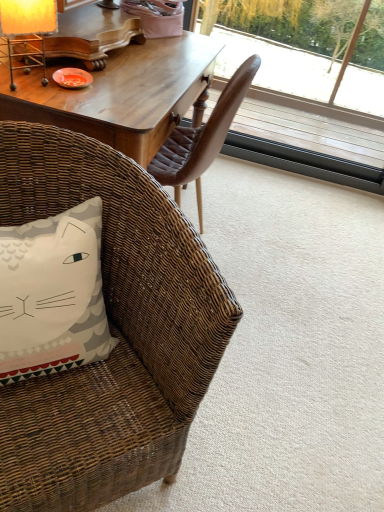
Question: In the image, is white fabric pillow with cat design at lower left positioned in front of or behind matte yellow lampshade at upper left?

Choices:
 (A) behind
 (B) front

Answer: (B)

Question: From the image's perspective, is white fabric pillow with cat design at lower left positioned above or below matte yellow lampshade at upper left?

Choices:
 (A) above
 (B) below

Answer: (B)

Question: Estimate the real-world distances between objects in this image. Which object is farther from the matte yellow lampshade at upper left?

Choices:
 (A) white fabric pillow with cat design at lower left
 (B) transparent glass window at upper right
 (C) woven brown chair at lower left

Answer: (B)

Question: Which of these objects is positioned closest to the matte yellow lampshade at upper left?

Choices:
 (A) woven brown chair at lower left
 (B) transparent glass window at upper right
 (C) white fabric pillow with cat design at lower left

Answer: (C)